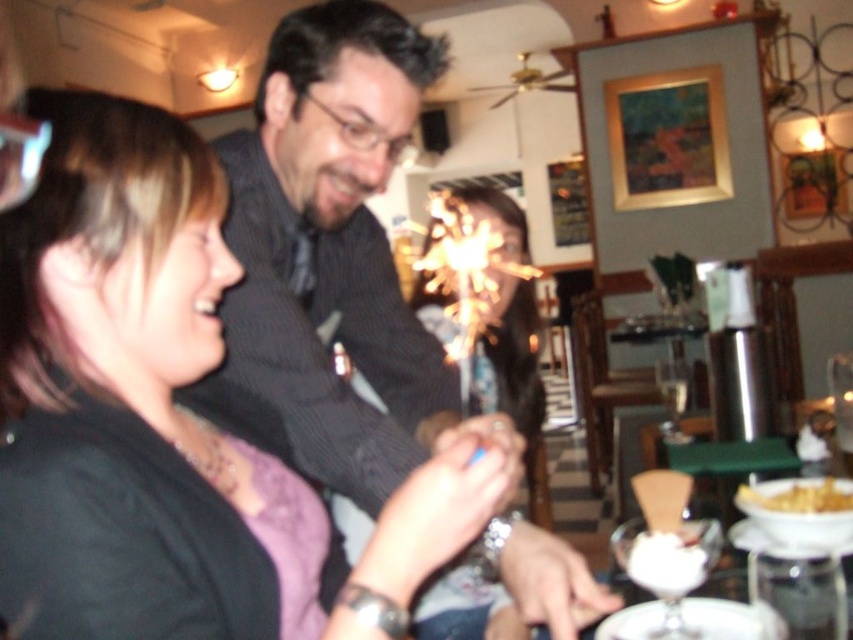
Which is below, shiny black shirt at center or white frosted glass at lower right?

white frosted glass at lower right is below.

Does shiny black shirt at center have a larger size compared to white frosted glass at lower right?

Yes, shiny black shirt at center is bigger than white frosted glass at lower right.

Does point (335, 19) come behind point (697, 560)?

Yes, it is behind point (697, 560).

The image size is (853, 640). What are the coordinates of `shiny black shirt at center` in the screenshot? It's located at (335, 252).

Measure the distance between matte black shirt at center and white frosted glass at lower right.

They are 19.31 inches apart.

Which is behind, point (24, 449) or point (712, 563)?

The point (712, 563) is more distant.

Locate an element on the screen. matte black shirt at center is located at coordinates (166, 419).

Does white creamy dessert at lower right appear over clear glass wine glass at right?

Actually, white creamy dessert at lower right is below clear glass wine glass at right.

Can you confirm if white creamy dessert at lower right is thinner than clear glass wine glass at right?

Correct, white creamy dessert at lower right's width is less than clear glass wine glass at right's.

The image size is (853, 640). What do you see at coordinates (799, 497) in the screenshot?
I see `white creamy dessert at lower right` at bounding box center [799, 497].

Identify the location of white creamy dessert at lower right. Image resolution: width=853 pixels, height=640 pixels. (799, 497).